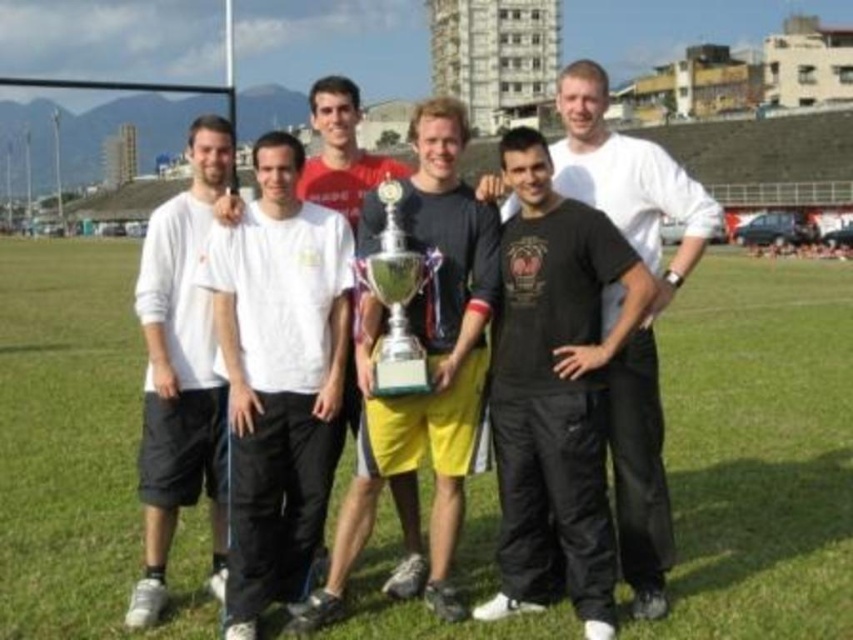
Between white matte t-shirt at center and silver metallic trophy at center, which one appears on the left side from the viewer's perspective?

From the viewer's perspective, white matte t-shirt at center appears more on the left side.

Between white matte t-shirt at center and silver metallic trophy at center, which one appears on the right side from the viewer's perspective?

From the viewer's perspective, silver metallic trophy at center appears more on the right side.

What do you see at coordinates (277, 378) in the screenshot? The width and height of the screenshot is (853, 640). I see `white matte t-shirt at center` at bounding box center [277, 378].

You are a GUI agent. You are given a task and a screenshot of the screen. Output one action in this format:
    pyautogui.click(x=<x>, y=<y>)
    Task: Click on the white matte t-shirt at center
    
    Given the screenshot: What is the action you would take?
    pyautogui.click(x=277, y=378)

Does white matte t-shirt at center have a greater width compared to black matte pants at center?

In fact, white matte t-shirt at center might be narrower than black matte pants at center.

Does white matte t-shirt at center appear on the right side of black matte pants at center?

No, white matte t-shirt at center is not to the right of black matte pants at center.

Locate an element on the screen. white matte t-shirt at center is located at coordinates (277, 378).

Does black matte pants at center have a larger size compared to silver metallic trophy at center?

Yes, black matte pants at center is bigger than silver metallic trophy at center.

Does black matte pants at center lie in front of silver metallic trophy at center?

Yes, it is in front of silver metallic trophy at center.

Between point (601, 113) and point (399, 392), which one is positioned behind?

Positioned behind is point (601, 113).

Find the location of a particular element. Image resolution: width=853 pixels, height=640 pixels. black matte pants at center is located at coordinates (642, 316).